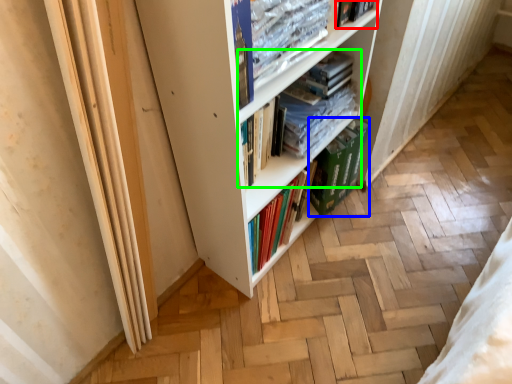
Question: Which object is positioned closest to book (highlighted by a red box)? Select from paperback book (highlighted by a blue box) and book (highlighted by a green box).

Choices:
 (A) paperback book
 (B) book

Answer: (B)